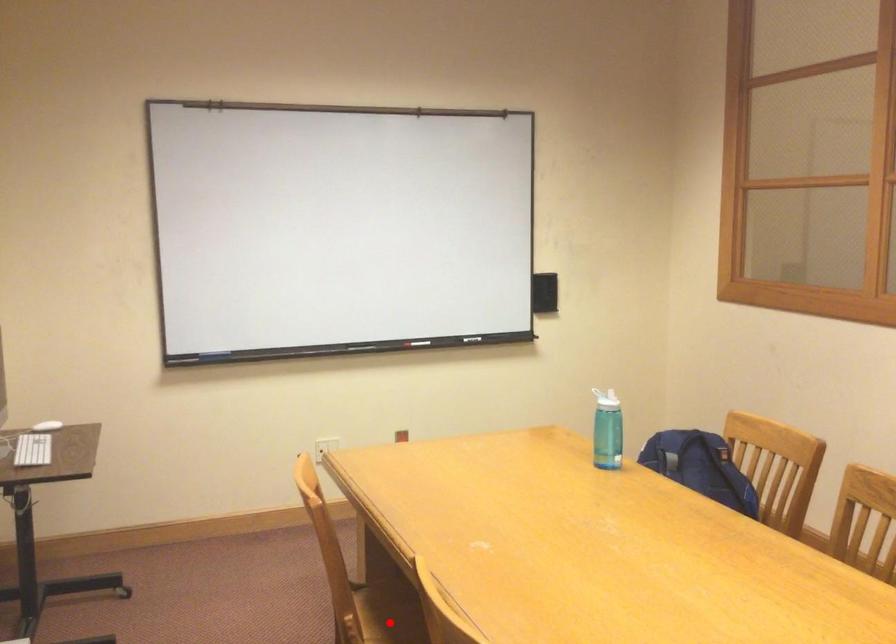
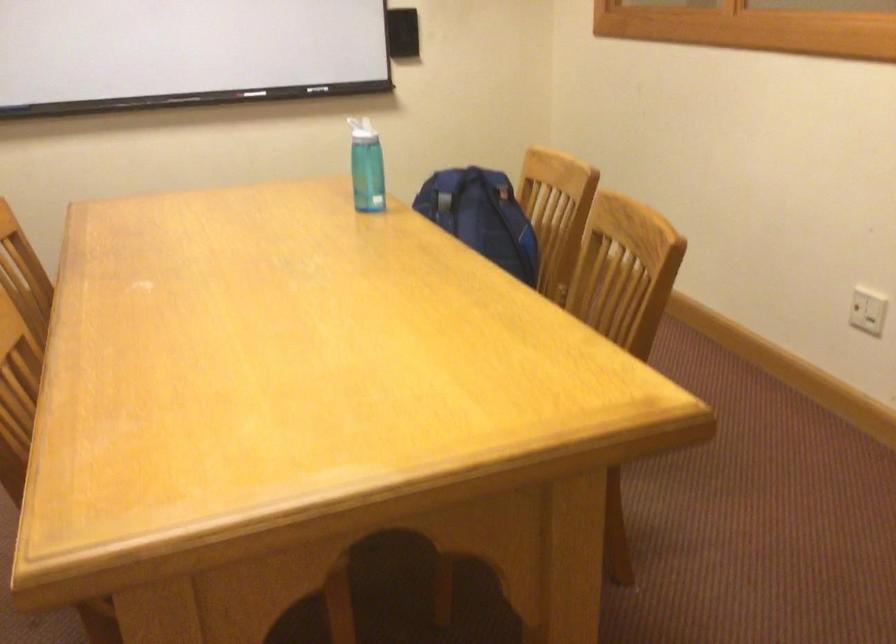
Question: I am providing you with two images of the same scene from different viewpoints. A red point is marked on the first image. At the location where the point appears in image 1, is it still visible in image 2?

Choices:
 (A) Yes
 (B) No

Answer: (B)